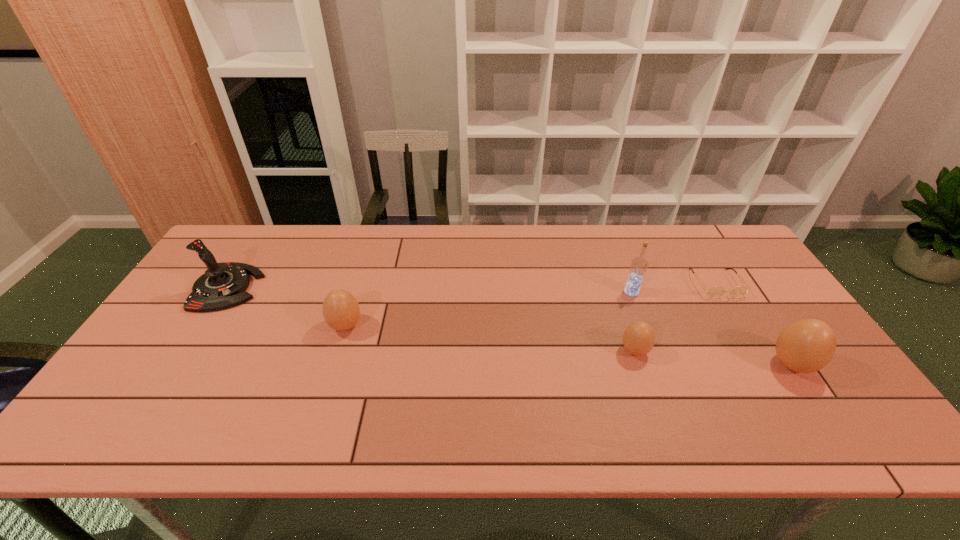
At what (x,y) coordinates should I click in order to perform the action: click on spectacles that is at the right edge. Please return your answer as a coordinate pair (x, y). Looking at the image, I should click on (714, 292).

Where is `object located in the far left corner section of the desktop`? This screenshot has height=540, width=960. object located in the far left corner section of the desktop is located at coordinates tap(223, 285).

Where is `object that is positioned at the far right corner`? This screenshot has width=960, height=540. object that is positioned at the far right corner is located at coordinates (714, 292).

Locate an element on the screen. The image size is (960, 540). object present at the near right corner is located at coordinates (808, 345).

This screenshot has width=960, height=540. Find the location of `free space at the far edge`. free space at the far edge is located at coordinates (600, 230).

Locate an element on the screen. Image resolution: width=960 pixels, height=540 pixels. vacant space at the near edge is located at coordinates (648, 384).

In the image, there is a desktop. At what (x,y) coordinates should I click in order to perform the action: click on vacant space at the right edge. Please return your answer as a coordinate pair (x, y). This screenshot has width=960, height=540. Looking at the image, I should click on (762, 302).

Where is `vacant space at the far left corner of the desktop`? This screenshot has width=960, height=540. vacant space at the far left corner of the desktop is located at coordinates (248, 226).

Identify the location of free space at the near right corner of the desktop. The height and width of the screenshot is (540, 960). (777, 381).

At what (x,y) coordinates should I click in order to perform the action: click on vacant space in between the vodka and the spectacles. Please return your answer as a coordinate pair (x, y). This screenshot has height=540, width=960. Looking at the image, I should click on (673, 288).